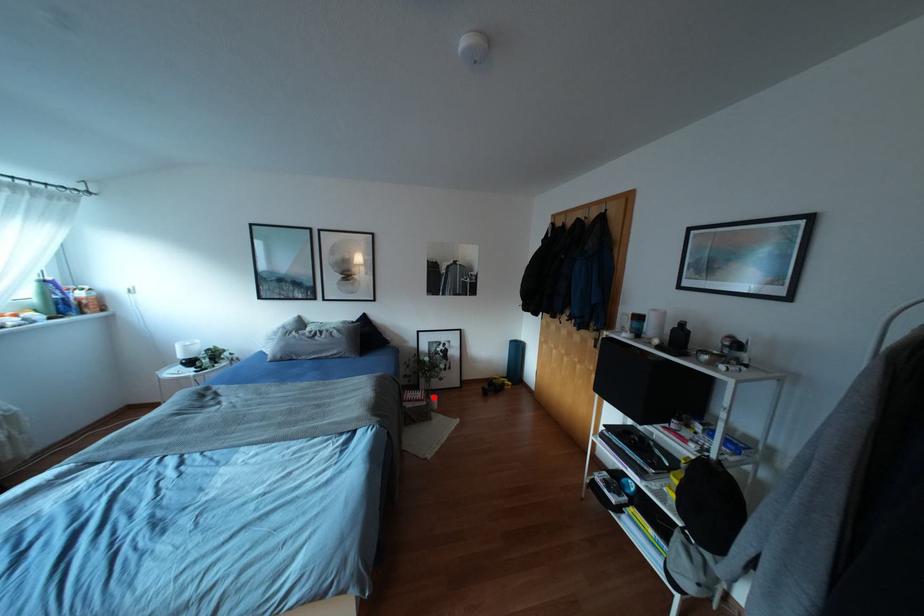
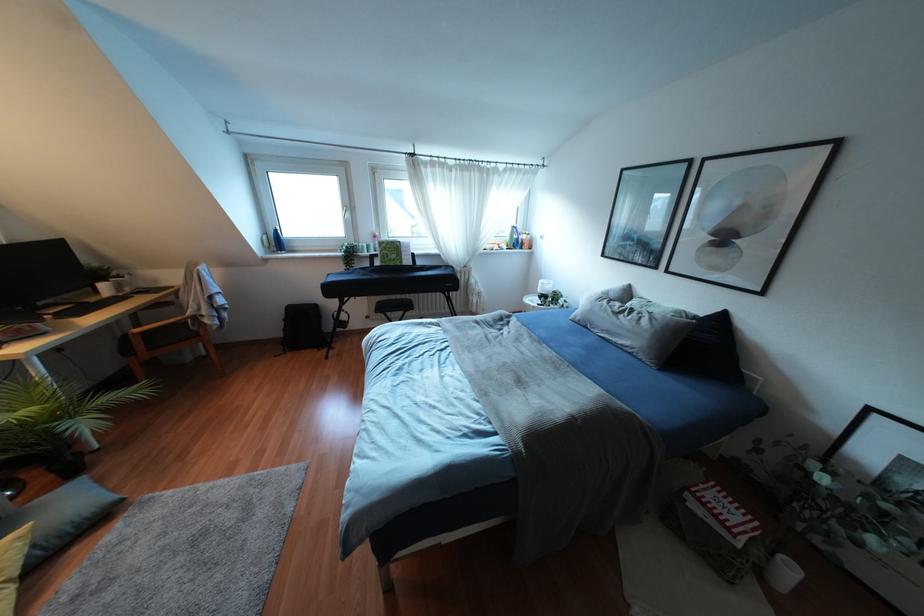
Question: I am providing you with two images of the same scene from different viewpoints. Given a red point in image1, look at the same physical point in image2. Is it:

Choices:
 (A) Closer to the viewpoint
 (B) Farther from the viewpoint

Answer: (A)